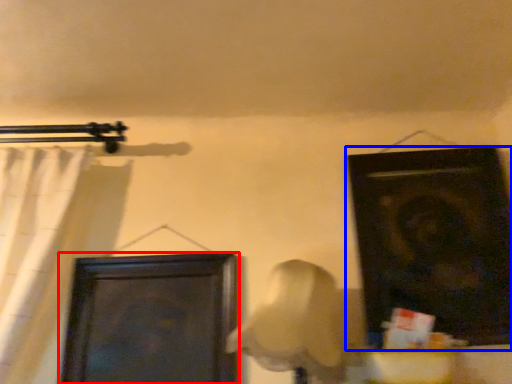
Question: Which object is further to the camera taking this photo, door (highlighted by a red box) or door (highlighted by a blue box)?

Choices:
 (A) door
 (B) door

Answer: (A)